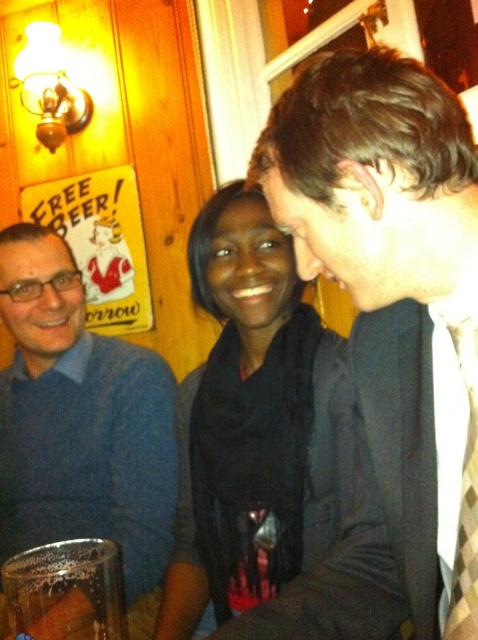
This screenshot has height=640, width=478. I want to click on clear glass cup at lower left, so click(x=66, y=592).

Measure the distance between clear glass cup at lower left and argyle-patterned tie at right.

clear glass cup at lower left is 41.60 centimeters away from argyle-patterned tie at right.

The image size is (478, 640). What are the coordinates of `clear glass cup at lower left` in the screenshot? It's located at (66, 592).

Which is more to the right, black matte scarf at center or blue sweater at left?

Positioned to the right is black matte scarf at center.

Does point (243, 556) lie behind point (0, 301)?

No.

The height and width of the screenshot is (640, 478). What are the coordinates of `black matte scarf at center` in the screenshot? It's located at (256, 422).

You are a GUI agent. You are given a task and a screenshot of the screen. Output one action in this format:
    pyautogui.click(x=<x>, y=<y>)
    Task: Click on the black matte scarf at center
    
    Given the screenshot: What is the action you would take?
    (256, 422)

Between point (212, 476) and point (454, 609), which one is positioned in front?

Point (454, 609)

Where is `black matte scarf at center`? This screenshot has height=640, width=478. black matte scarf at center is located at coordinates (256, 422).